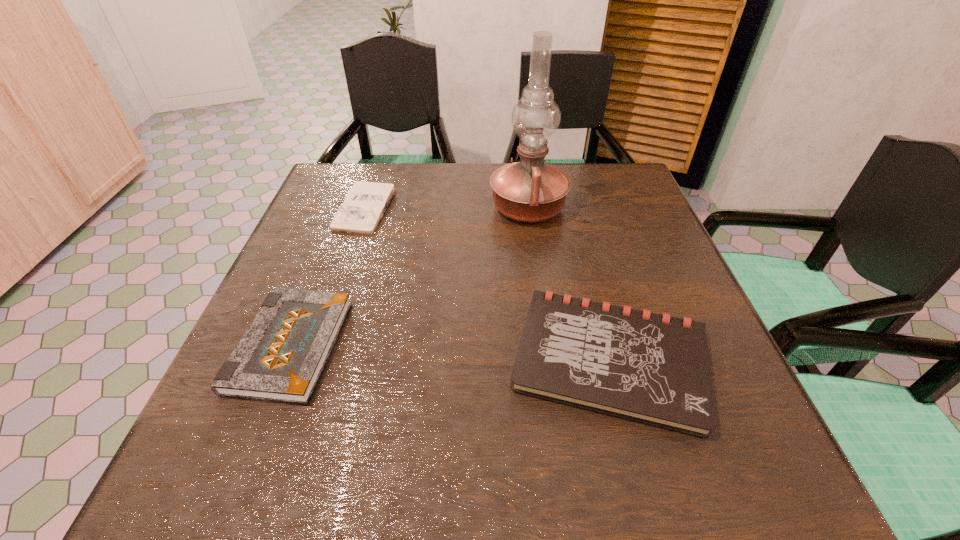
At what (x,y) coordinates should I click in order to perform the action: click on the tallest object. Please return your answer as a coordinate pair (x, y). Looking at the image, I should click on (529, 190).

This screenshot has width=960, height=540. I want to click on the rightmost notebook, so click(650, 368).

At what (x,y) coordinates should I click in order to perform the action: click on the shortest notebook. Please return your answer as a coordinate pair (x, y). The image size is (960, 540). Looking at the image, I should click on (363, 207).

Locate an element on the screen. The image size is (960, 540). the farthest notebook is located at coordinates pos(363,207).

Locate an element on the screen. free space located 0.160m on the front of the tallest object is located at coordinates (538, 276).

In order to click on blank space located on the back of the rightmost notebook in this screenshot , I will do `click(589, 280)`.

Locate an element on the screen. The image size is (960, 540). free space located on the front of the farthest notebook is located at coordinates (324, 335).

You are a GUI agent. You are given a task and a screenshot of the screen. Output one action in this format:
    pyautogui.click(x=<x>, y=<y>)
    Task: Click on the oil lamp that is positioned at the far edge
    This screenshot has width=960, height=540.
    Given the screenshot: What is the action you would take?
    pyautogui.click(x=529, y=190)

What are the coordinates of `notebook that is at the far edge` in the screenshot? It's located at (363, 207).

This screenshot has width=960, height=540. What are the coordinates of `object that is at the right edge` in the screenshot? It's located at (650, 368).